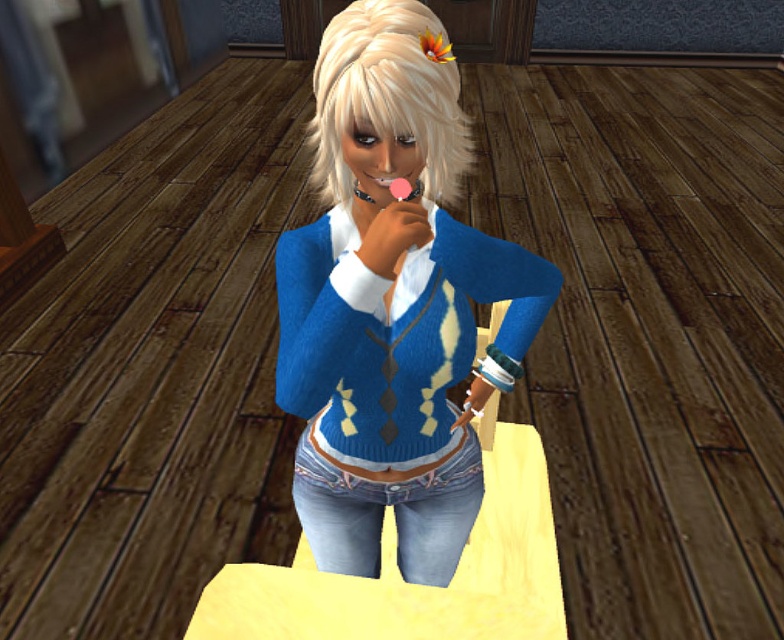
You are a fashion designer observing the character in the image. You need to determine the spatial relationship between the blue knitted sweater at center and the blondehair at center. Which object is positioned lower in the image?

The blue knitted sweater at center is positioned lower than the blondehair at center in the image.

The character is adjusting their clothing. Based on the scene, which item is positioned lower on the body between the blue knitted cardigan at center and the blondehair at center?

The blue knitted cardigan at center is positioned lower on the body than the blondehair at center.